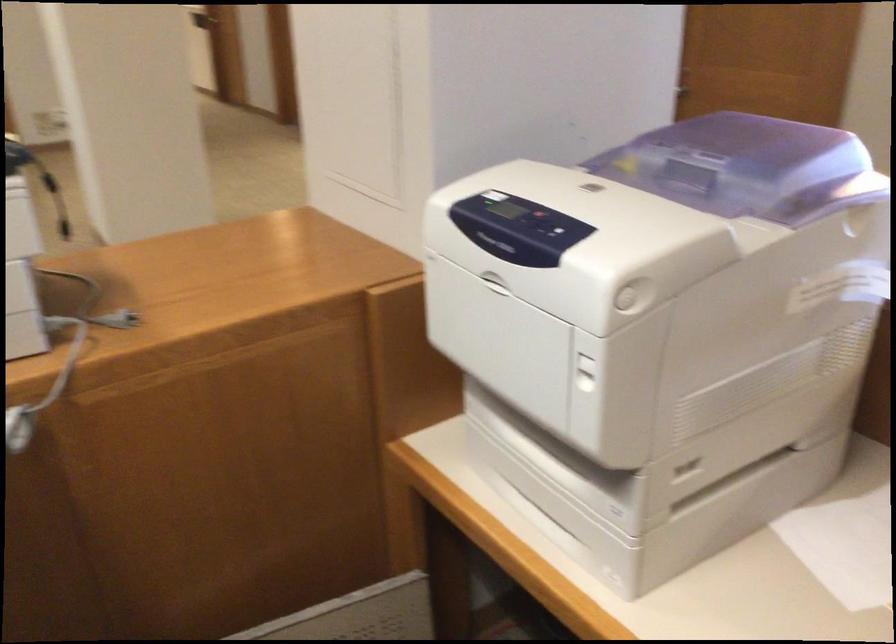
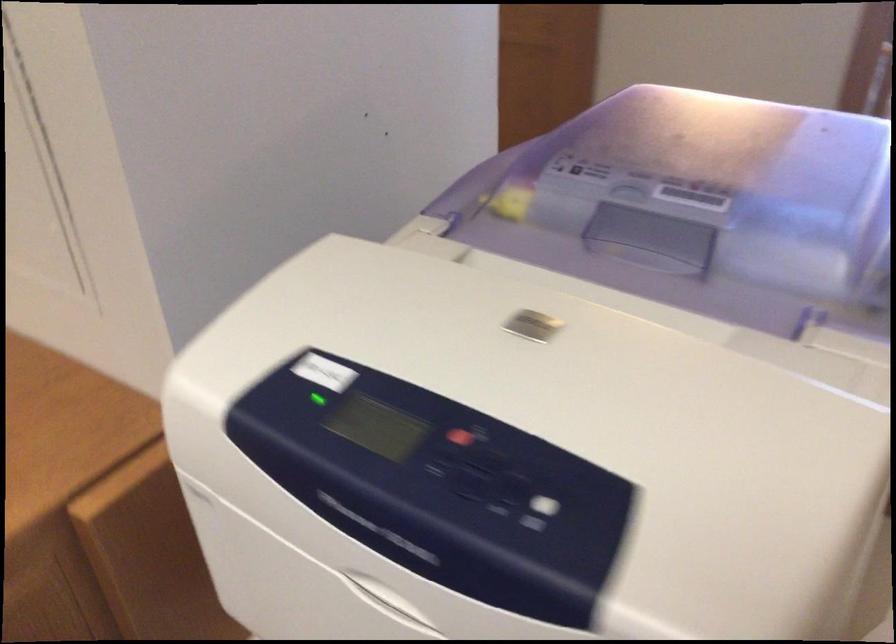
The point at (598, 184) is marked in the first image. Where is the corresponding point in the second image?

(539, 325)